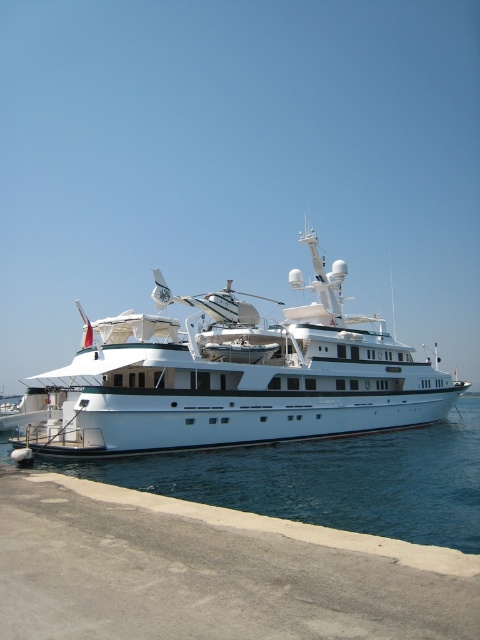
Between point (121, 355) and point (440, 435), which one is positioned behind?

Positioned behind is point (440, 435).

Can you confirm if white glossy yacht at center is thinner than clear blue water at lower center?

Correct, white glossy yacht at center's width is less than clear blue water at lower center's.

Between point (288, 314) and point (467, 512), which one is positioned in front?

Positioned in front is point (467, 512).

This screenshot has width=480, height=640. What are the coordinates of `white glossy yacht at center` in the screenshot? It's located at (231, 378).